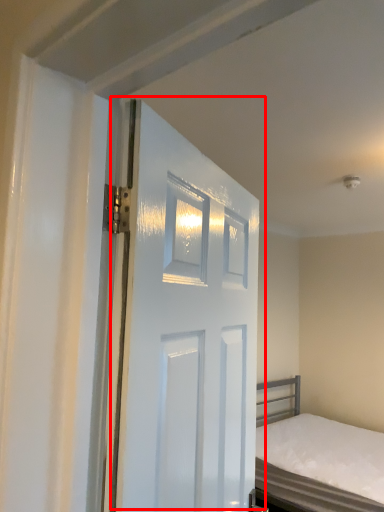
Question: Where is door (annotated by the red box) located in relation to bed in the image?

Choices:
 (A) right
 (B) left

Answer: (B)